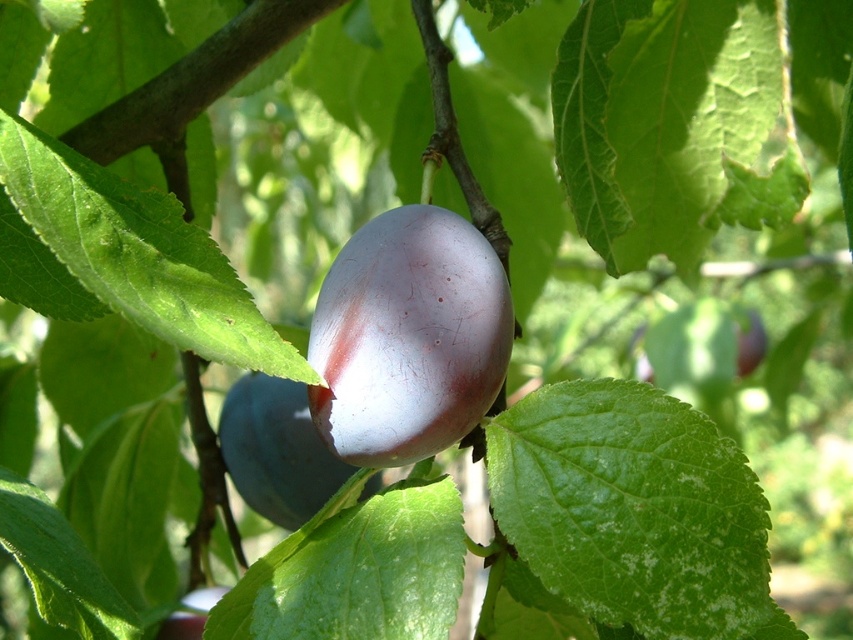
You are an artist trying to paint the plum tree scene. You notice two plums at the center. How far apart are the purple glossy plum at center and the shiny purple plum at center?

The purple glossy plum at center is 16.47 inches from shiny purple plum at center.

You are an artist trying to paint the plum tree scene. You need to decide which plum to focus on first based on their height. Which plum should you paint first, the purple glossy plum at center or the shiny purple plum at center?

The purple glossy plum at center is much taller than the shiny purple plum at center, so you should paint the purple glossy plum at center first to capture its height accurately.